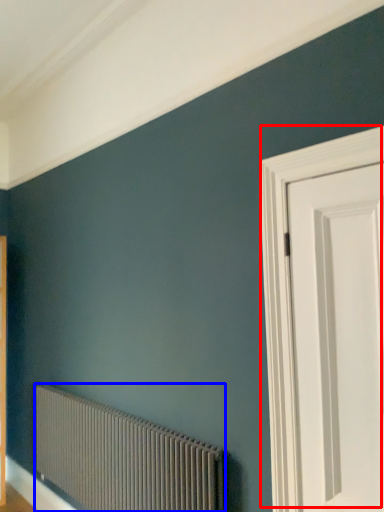
Question: Which object is closer to the camera taking this photo, door (highlighted by a red box) or radiator (highlighted by a blue box)?

Choices:
 (A) door
 (B) radiator

Answer: (A)